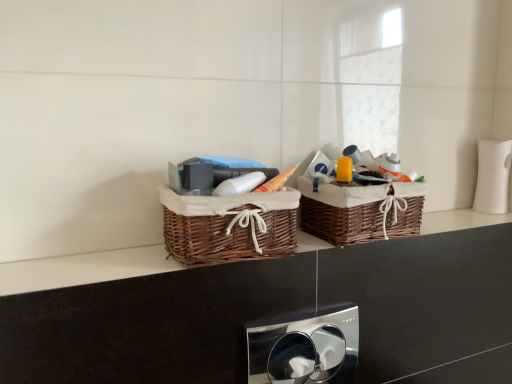
Question: Is brown wicker baskets at center not close to woven brown basket at center, which is the 1th picnic basket in right-to-left order?

Choices:
 (A) yes
 (B) no

Answer: (B)

Question: Can you confirm if brown wicker baskets at center is bigger than woven brown basket at center, which is the 1th picnic basket in right-to-left order?

Choices:
 (A) no
 (B) yes

Answer: (A)

Question: Are brown wicker baskets at center and woven brown basket at center, which is the 1th picnic basket in right-to-left order, making contact?

Choices:
 (A) no
 (B) yes

Answer: (A)

Question: From the image's perspective, is brown wicker baskets at center below woven brown basket at center, which is the 1th picnic basket in right-to-left order?

Choices:
 (A) yes
 (B) no

Answer: (A)

Question: Does brown wicker baskets at center have a greater width compared to woven brown basket at center, which is the 2th picnic basket in left-to-right order?

Choices:
 (A) yes
 (B) no

Answer: (B)

Question: Based on their sizes in the image, would you say chrome metallic flush plate at center is bigger or smaller than brown wicker baskets at center?

Choices:
 (A) big
 (B) small

Answer: (A)

Question: From a real-world perspective, is chrome metallic flush plate at center positioned above or below brown wicker baskets at center?

Choices:
 (A) above
 (B) below

Answer: (B)

Question: In terms of width, does chrome metallic flush plate at center look wider or thinner when compared to brown wicker baskets at center?

Choices:
 (A) wide
 (B) thin

Answer: (B)

Question: Would you say chrome metallic flush plate at center is to the left or to the right of brown wicker baskets at center in the picture?

Choices:
 (A) right
 (B) left

Answer: (B)

Question: Considering the relative positions of chrome metallic flush plate at center and woven brown basket at center, which is the first picnic basket in left-to-right order, in the image provided, is chrome metallic flush plate at center to the left or to the right of woven brown basket at center, which is the first picnic basket in left-to-right order,?

Choices:
 (A) right
 (B) left

Answer: (A)

Question: Is chrome metallic flush plate at center in front of or behind woven brown basket at center, which is the first picnic basket in left-to-right order, in the image?

Choices:
 (A) front
 (B) behind

Answer: (B)

Question: Is chrome metallic flush plate at center wider or thinner than woven brown basket at center, which appears as the 2th picnic basket when viewed from the right?

Choices:
 (A) wide
 (B) thin

Answer: (B)

Question: From their relative heights in the image, would you say chrome metallic flush plate at center is taller or shorter than woven brown basket at center, which is the first picnic basket in left-to-right order?

Choices:
 (A) tall
 (B) short

Answer: (A)

Question: Does point (178, 256) appear closer or farther from the camera than point (361, 223)?

Choices:
 (A) farther
 (B) closer

Answer: (B)

Question: Considering their positions, is woven brown basket at center, which is the first picnic basket in left-to-right order, located in front of or behind woven brown basket at center, which is the 2th picnic basket in left-to-right order?

Choices:
 (A) behind
 (B) front

Answer: (B)